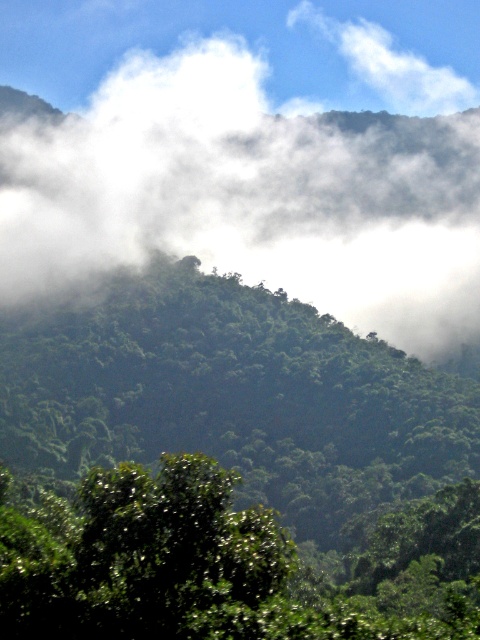
Consider the image. You are a hiker standing at the base of the mountain. You see the green leafy tree at center and the white fluffy fog at upper center. How far apart are these two landmarks?

The distance between the green leafy tree at center and the white fluffy fog at upper center is 531.66 feet.

You are an explorer trying to locate the green leafy tree at center and the white fluffy fog at upper center in the mountainous landscape. According to the scene, which object is positioned to the right of the other?

The green leafy tree at center is positioned to the right of the white fluffy fog at upper center.